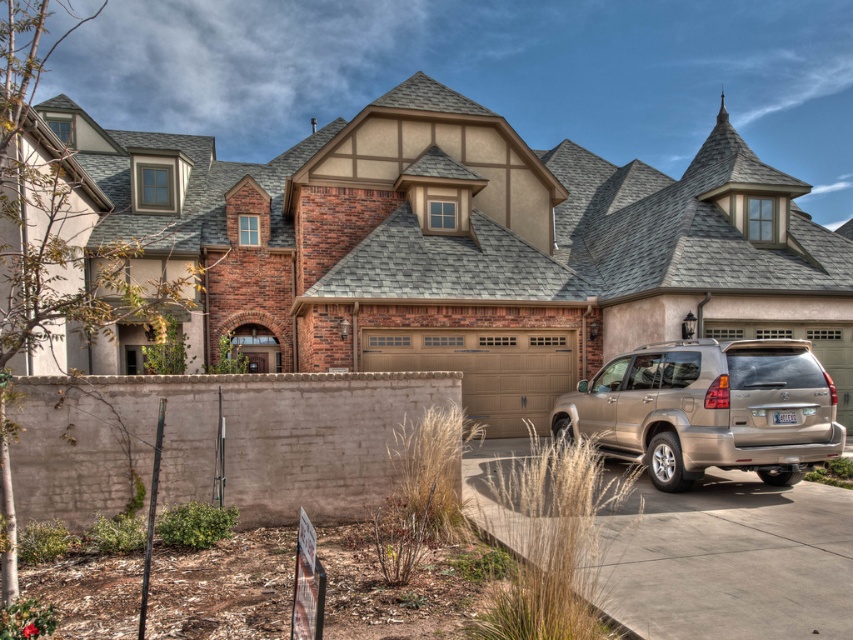
Question: Which point is closer to the camera?

Choices:
 (A) gold metallic suv at lower right
 (B) tan/glass-like material garage door at center
 (C) concrete at center

Answer: (C)

Question: Is concrete at center to the right of tan/glass-like material garage door at center from the viewer's perspective?

Choices:
 (A) yes
 (B) no

Answer: (B)

Question: Does gold metallic suv at lower right appear under tan/glass-like material garage door at center?

Choices:
 (A) no
 (B) yes

Answer: (B)

Question: Which object is closer to the camera taking this photo?

Choices:
 (A) gold metallic suv at lower right
 (B) concrete at center

Answer: (B)

Question: Which object is farther from the camera taking this photo?

Choices:
 (A) concrete at center
 (B) gold metallic suv at lower right

Answer: (B)

Question: Can you confirm if concrete at center is positioned to the right of tan/glass-like material garage door at center?

Choices:
 (A) no
 (B) yes

Answer: (A)